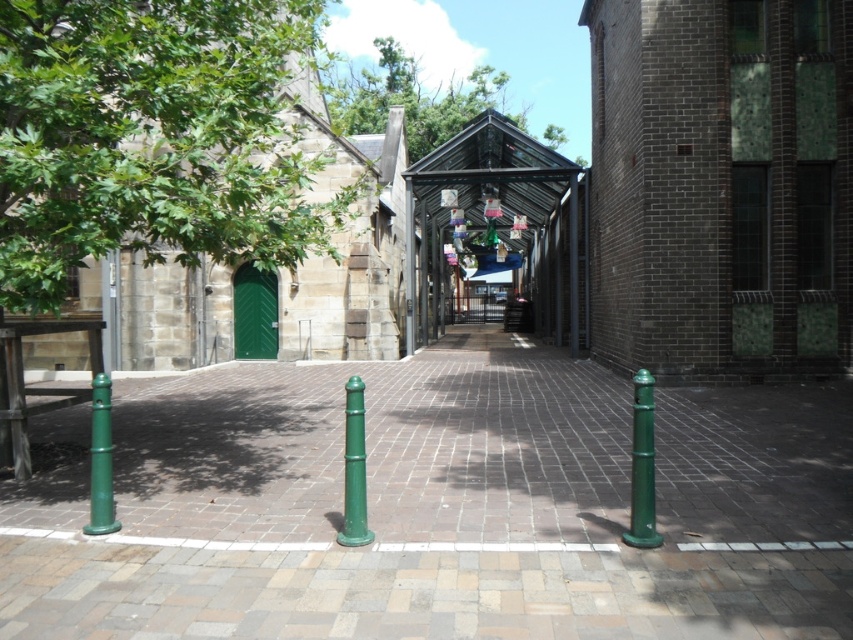
Question: Does smooth stone pavement at center lie in front of green matte post at left?

Choices:
 (A) no
 (B) yes

Answer: (B)

Question: Which of the following is the closest to the observer?

Choices:
 (A) smooth stone pavement at center
 (B) green polished concrete pavement at center
 (C) green leafy tree at upper center
 (D) green matte post at center

Answer: (A)

Question: Which of the following is the closest to the observer?

Choices:
 (A) green leafy tree at upper center
 (B) green matte post at center-right
 (C) green matte post at left

Answer: (B)

Question: Which object is closer to the camera taking this photo?

Choices:
 (A) smooth stone pavement at center
 (B) green matte post at center
 (C) green leafy tree at upper center
 (D) green leafy tree at upper left

Answer: (A)

Question: From the image, what is the correct spatial relationship of green polished concrete pavement at center in relation to green leafy tree at upper left?

Choices:
 (A) right
 (B) left

Answer: (A)

Question: From the image, what is the correct spatial relationship of green polished concrete pavement at center in relation to smooth stone pavement at center?

Choices:
 (A) left
 (B) right

Answer: (A)